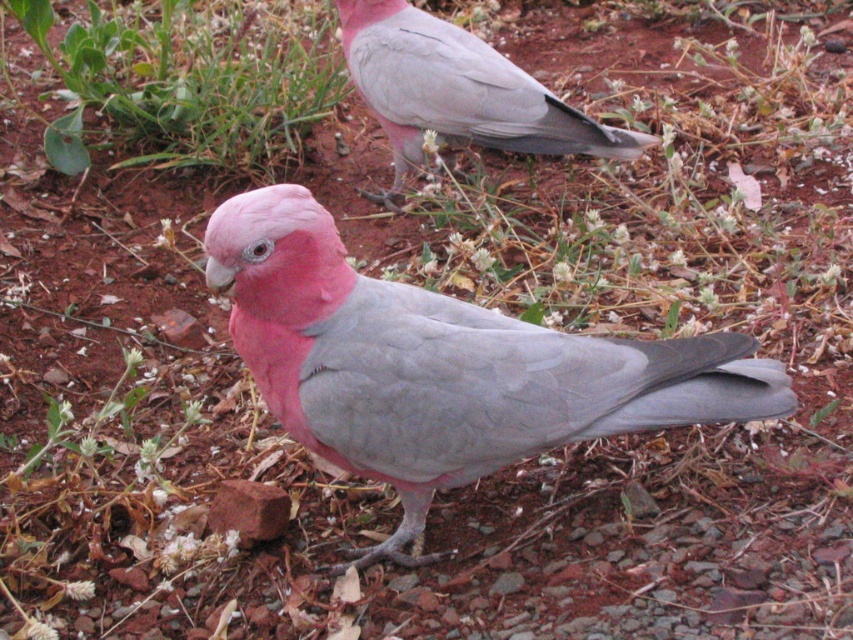
Which of these two, matte pink parrot at center or green leafy grass at upper left, stands taller?

With more height is green leafy grass at upper left.

The height and width of the screenshot is (640, 853). Describe the element at coordinates (442, 365) in the screenshot. I see `matte pink parrot at center` at that location.

The width and height of the screenshot is (853, 640). What are the coordinates of `matte pink parrot at center` in the screenshot? It's located at (442, 365).

Who is positioned more to the left, green leafy grass at upper left or pink matte parrot at upper center?

From the viewer's perspective, green leafy grass at upper left appears more on the left side.

Can you confirm if green leafy grass at upper left is positioned to the right of pink matte parrot at upper center?

In fact, green leafy grass at upper left is to the left of pink matte parrot at upper center.

Locate an element on the screen. green leafy grass at upper left is located at coordinates (190, 81).

Is matte pink parrot at center taller than pink matte parrot at upper center?

Yes.

Identify the location of matte pink parrot at center. (442, 365).